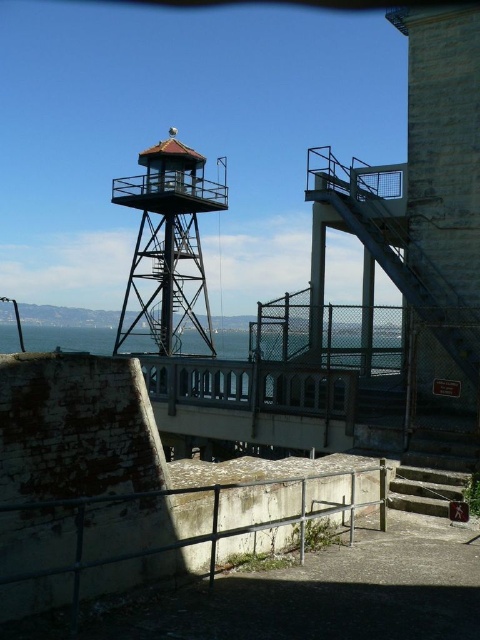
You are a maintenance worker needing to reach the watchtower. You see the rusty metal railing at lower center and the concrete stairs at lower right. Which object should you approach first to access the watchtower?

The rusty metal railing at lower center is in front of the concrete stairs at lower right, so you should approach the concrete stairs at lower right first to access the watchtower.

You are a maintenance worker needing to reach the metallic red observation tower at upper left from the concrete stairs at lower right. Given that you can walk 1.5 meters per second, how many seconds will it take you to reach the tower from the stairs?

The metallic red observation tower at upper left is 20.49 meters away from the concrete stairs at lower right. At a walking speed of 1.5 meters per second, it would take approximately 13.66 seconds to reach the tower. Since we typically round to the nearest whole number, it would take about 14 seconds.

You are a maintenance worker at the coastal fortification. You need to access the watchtower but are currently standing at point (169, 289). There is another point at (71, 534). Which point should you move towards to get closer to the watchtower?

You should move towards point (71, 534) because it is in front of point (169, 289), meaning it is closer to the watchtower.